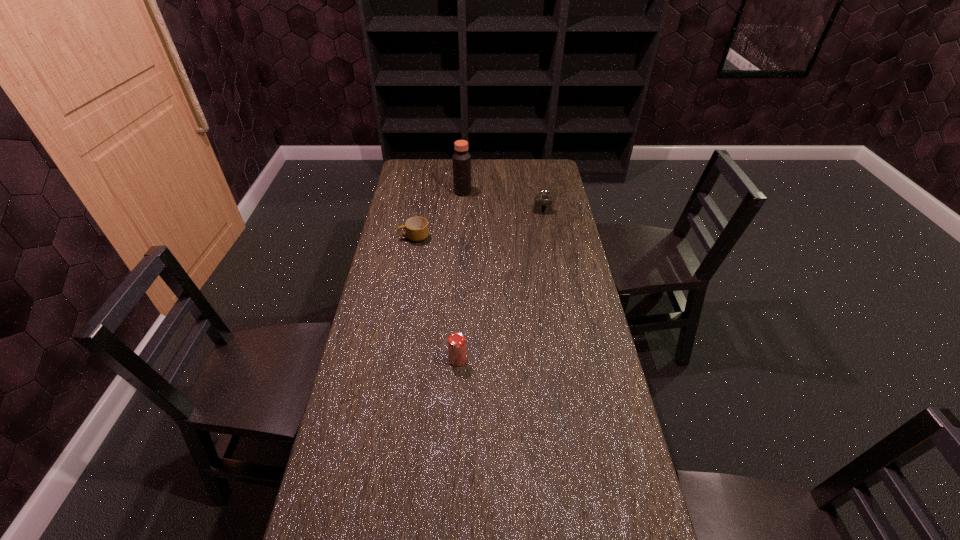
Find the location of a particular element. object located in the left edge section of the desktop is located at coordinates (417, 229).

Identify the location of object that is at the right edge. This screenshot has width=960, height=540. (542, 203).

In the image, there is a desktop. What are the coordinates of `vacant space at the far edge` in the screenshot? It's located at click(446, 170).

At what (x,y) coordinates should I click in order to perform the action: click on vacant space at the left edge of the desktop. Please return your answer as a coordinate pair (x, y). Looking at the image, I should click on (382, 345).

Image resolution: width=960 pixels, height=540 pixels. I want to click on vacant region at the right edge, so click(x=585, y=419).

Find the location of `vacant space at the far left corner of the desktop`. vacant space at the far left corner of the desktop is located at coordinates (436, 163).

This screenshot has width=960, height=540. Find the location of `vacant space at the far right corner of the desktop`. vacant space at the far right corner of the desktop is located at coordinates (555, 161).

Locate an element on the screen. unoccupied area between the vinegar and the padlock is located at coordinates (503, 201).

At what (x,y) coordinates should I click in order to perform the action: click on unoccupied area between the tallest object and the third farthest object. Please return your answer as a coordinate pair (x, y). Image resolution: width=960 pixels, height=540 pixels. Looking at the image, I should click on [439, 214].

This screenshot has height=540, width=960. In order to click on free space between the beer can and the second farthest object in this screenshot , I will do `click(500, 286)`.